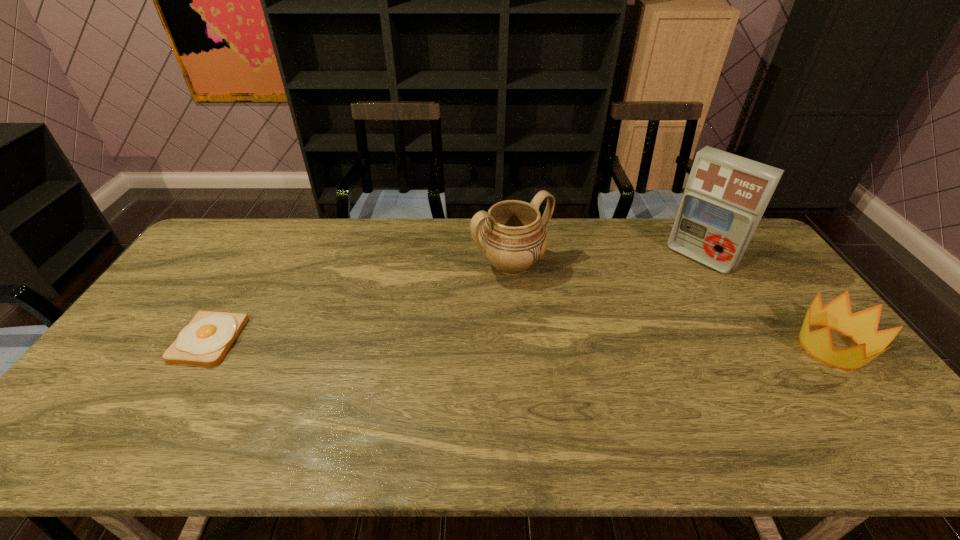
You are a GUI agent. You are given a task and a screenshot of the screen. Output one action in this format:
    pyautogui.click(x=<x>, y=<y>)
    Task: Click on the first-aid kit located at the right edge
    This screenshot has width=960, height=540.
    Given the screenshot: What is the action you would take?
    pyautogui.click(x=726, y=195)

I want to click on object that is at the far right corner, so click(x=726, y=195).

Find the location of a particular element. free spot at the far edge of the desktop is located at coordinates (265, 248).

What are the coordinates of `vacant space at the left edge of the desktop` in the screenshot? It's located at (186, 302).

In the image, there is a desktop. Where is `blank space at the right edge`? blank space at the right edge is located at coordinates (754, 282).

At what (x,y) coordinates should I click in order to perform the action: click on vacant area between the tallest object and the rightmost object. Please return your answer as a coordinate pair (x, y). The height and width of the screenshot is (540, 960). Looking at the image, I should click on (766, 302).

Locate an element on the screen. This screenshot has width=960, height=540. empty location between the second shortest object and the third shortest object is located at coordinates (671, 306).

Image resolution: width=960 pixels, height=540 pixels. Identify the location of empty space that is in between the shortest object and the third tallest object. click(x=520, y=343).

This screenshot has width=960, height=540. Find the location of `free point between the shortest object and the tallest object`. free point between the shortest object and the tallest object is located at coordinates (454, 299).

Identify the location of unoccupied position between the leftmost object and the urn. (360, 302).